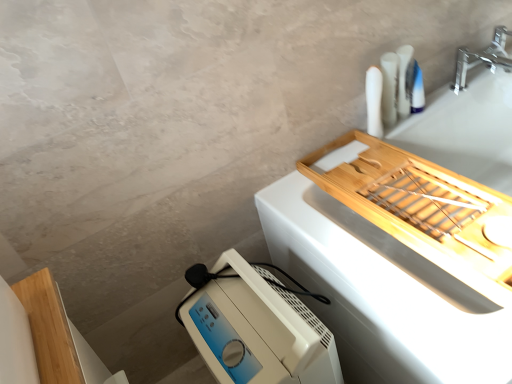
This screenshot has width=512, height=384. Describe the element at coordinates (383, 294) in the screenshot. I see `natural wood tray at upper right` at that location.

Locate an element on the screen. Image resolution: width=512 pixels, height=384 pixels. white plastic humidifier at lower left is located at coordinates (257, 329).

Locate an element on the screen. white matte toothpaste tubes at upper right, which is counted as the 2th toiletry, starting from the left is located at coordinates (405, 80).

Could you tell me if white matte toothpaste tubes at upper right, which is counted as the 2th toiletry, starting from the left, is facing white plastic toothbrush at upper right, which is the 3th toiletry from right to left?

No, white matte toothpaste tubes at upper right, which is counted as the 2th toiletry, starting from the left, is not aimed at white plastic toothbrush at upper right, which is the 3th toiletry from right to left.

Between white matte toothpaste tubes at upper right, which is counted as the 2th toiletry, starting from the left, and white plastic toothbrush at upper right, acting as the first toiletry starting from the left, which one appears on the right side from the viewer's perspective?

Result: white matte toothpaste tubes at upper right, which is counted as the 2th toiletry, starting from the left.

Does white matte toothpaste tubes at upper right, which is counted as the 2th toiletry, starting from the left, have a smaller size compared to white plastic toothbrush at upper right, acting as the first toiletry starting from the left?

Indeed, white matte toothpaste tubes at upper right, which is counted as the 2th toiletry, starting from the left, has a smaller size compared to white plastic toothbrush at upper right, acting as the first toiletry starting from the left.

From a real-world perspective, between white matte toothpaste tubes at upper right, the second toiletry in the right-to-left sequence, and white plastic toothbrush at upper right, acting as the first toiletry starting from the left, who is vertically lower?

white matte toothpaste tubes at upper right, the second toiletry in the right-to-left sequence, is physically lower.

Which object is positioned more to the left, white plastic toothpaste tube at upper right, acting as the 3th toiletry starting from the left, or silver metallic faucet at upper right?

From the viewer's perspective, white plastic toothpaste tube at upper right, acting as the 3th toiletry starting from the left, appears more on the left side.

Does white plastic toothpaste tube at upper right, which ranks as the 1th toiletry in right-to-left order, touch silver metallic faucet at upper right?

No, white plastic toothpaste tube at upper right, which ranks as the 1th toiletry in right-to-left order, is not with silver metallic faucet at upper right.

Which object is further away from the camera, white plastic toothpaste tube at upper right, which ranks as the 1th toiletry in right-to-left order, or silver metallic faucet at upper right?

silver metallic faucet at upper right is further from the camera.

Does natural wood tray at upper right have a lesser width compared to white plastic toothbrush at upper right, acting as the first toiletry starting from the left?

In fact, natural wood tray at upper right might be wider than white plastic toothbrush at upper right, acting as the first toiletry starting from the left.

From the image's perspective, which object appears higher, natural wood tray at upper right or white plastic toothbrush at upper right, which is the 3th toiletry from right to left?

white plastic toothbrush at upper right, which is the 3th toiletry from right to left.

From a real-world perspective, is natural wood tray at upper right beneath white plastic toothbrush at upper right, which is the 3th toiletry from right to left?

Yes, from a real-world perspective, natural wood tray at upper right is below white plastic toothbrush at upper right, which is the 3th toiletry from right to left.

Is natural wood tray at upper right oriented towards white plastic toothbrush at upper right, which is the 3th toiletry from right to left?

No.

Measure the distance from white matte toothpaste tubes at upper right, which is counted as the 2th toiletry, starting from the left, to silver metallic faucet at upper right.

A distance of 11.56 inches exists between white matte toothpaste tubes at upper right, which is counted as the 2th toiletry, starting from the left, and silver metallic faucet at upper right.

Who is shorter, white matte toothpaste tubes at upper right, the second toiletry in the right-to-left sequence, or silver metallic faucet at upper right?

silver metallic faucet at upper right.

From a real-world perspective, who is located lower, white matte toothpaste tubes at upper right, the second toiletry in the right-to-left sequence, or silver metallic faucet at upper right?

silver metallic faucet at upper right is physically lower.

From a real-world perspective, count 2nd toiletrys upward from the silver metallic faucet at upper right and point to it. Please provide its 2D coordinates.

[(405, 80)]

Does white plastic humidifier at lower left have a greater height compared to silver metallic faucet at upper right?

Correct, white plastic humidifier at lower left is much taller as silver metallic faucet at upper right.

How far apart are white plastic humidifier at lower left and silver metallic faucet at upper right?

A distance of 99.49 centimeters exists between white plastic humidifier at lower left and silver metallic faucet at upper right.

What's the angular difference between white plastic humidifier at lower left and silver metallic faucet at upper right's facing directions?

They differ by 91.2 degrees in their facing directions.

Is white plastic humidifier at lower left in contact with silver metallic faucet at upper right?

No, white plastic humidifier at lower left is not with silver metallic faucet at upper right.

Is white matte toothpaste tubes at upper right, which is counted as the 2th toiletry, starting from the left, at the right side of white plastic humidifier at lower left?

Yes, white matte toothpaste tubes at upper right, which is counted as the 2th toiletry, starting from the left, is to the right of white plastic humidifier at lower left.

Would you say white plastic humidifier at lower left is part of white matte toothpaste tubes at upper right, which is counted as the 2th toiletry, starting from the left,'s contents?

No, white plastic humidifier at lower left is not surrounded by white matte toothpaste tubes at upper right, which is counted as the 2th toiletry, starting from the left.

From the image's perspective, which one is positioned lower, white matte toothpaste tubes at upper right, which is counted as the 2th toiletry, starting from the left, or white plastic humidifier at lower left?

From the image's view, white plastic humidifier at lower left is below.

Between white matte toothpaste tubes at upper right, the second toiletry in the right-to-left sequence, and white plastic humidifier at lower left, which one has smaller size?

white matte toothpaste tubes at upper right, the second toiletry in the right-to-left sequence.

From the picture: Is white matte toothpaste tubes at upper right, which is counted as the 2th toiletry, starting from the left, positioned before natural wood tray at upper right?

No, the depth of white matte toothpaste tubes at upper right, which is counted as the 2th toiletry, starting from the left, is greater than that of natural wood tray at upper right.

Looking at this image, is white matte toothpaste tubes at upper right, which is counted as the 2th toiletry, starting from the left, oriented away from natural wood tray at upper right?

No.

Who is smaller, white matte toothpaste tubes at upper right, which is counted as the 2th toiletry, starting from the left, or natural wood tray at upper right?

Smaller between the two is white matte toothpaste tubes at upper right, which is counted as the 2th toiletry, starting from the left.

Considering the sizes of objects white matte toothpaste tubes at upper right, which is counted as the 2th toiletry, starting from the left, and natural wood tray at upper right in the image provided, who is thinner, white matte toothpaste tubes at upper right, which is counted as the 2th toiletry, starting from the left, or natural wood tray at upper right?

white matte toothpaste tubes at upper right, which is counted as the 2th toiletry, starting from the left, is thinner.

Where is `toiletry in front of the white matte toothpaste tubes at upper right, which is counted as the 2th toiletry, starting from the left`? This screenshot has height=384, width=512. toiletry in front of the white matte toothpaste tubes at upper right, which is counted as the 2th toiletry, starting from the left is located at coordinates coord(374,101).

From the image's perspective, which toiletry is the 2nd one below the silver metallic faucet at upper right? Please provide its 2D coordinates.

[(417, 90)]

When comparing their distances from silver metallic faucet at upper right, does natural wood tray at upper right or white plastic toothpaste tube at upper right, acting as the 3th toiletry starting from the left, seem further?

natural wood tray at upper right.

From the image, which object appears to be farther from white plastic toothpaste tube at upper right, which ranks as the 1th toiletry in right-to-left order, white matte toothpaste tubes at upper right, the second toiletry in the right-to-left sequence, or silver metallic faucet at upper right?

silver metallic faucet at upper right lies further to white plastic toothpaste tube at upper right, which ranks as the 1th toiletry in right-to-left order, than the other object.

Considering their positions, is natural wood tray at upper right positioned closer to white plastic humidifier at lower left than white plastic toothbrush at upper right, acting as the first toiletry starting from the left?

natural wood tray at upper right.

Based on their spatial positions, is silver metallic faucet at upper right or white matte toothpaste tubes at upper right, which is counted as the 2th toiletry, starting from the left, further from white plastic toothpaste tube at upper right, acting as the 3th toiletry starting from the left?

silver metallic faucet at upper right is further to white plastic toothpaste tube at upper right, acting as the 3th toiletry starting from the left.

Based on the photo, from the image, which object appears to be nearer to white matte toothpaste tubes at upper right, the second toiletry in the right-to-left sequence, white plastic toothpaste tube at upper right, acting as the 3th toiletry starting from the left, or white plastic toothbrush at upper right, which is the 3th toiletry from right to left?

white plastic toothpaste tube at upper right, acting as the 3th toiletry starting from the left.

From the picture: Which object lies nearer to the anchor point white plastic toothpaste tube at upper right, which ranks as the 1th toiletry in right-to-left order, white plastic toothbrush at upper right, which is the 3th toiletry from right to left, or silver metallic faucet at upper right?

white plastic toothbrush at upper right, which is the 3th toiletry from right to left.

Consider the image. Based on their spatial positions, is natural wood tray at upper right or silver metallic faucet at upper right closer to white plastic toothbrush at upper right, which is the 3th toiletry from right to left?

silver metallic faucet at upper right lies closer to white plastic toothbrush at upper right, which is the 3th toiletry from right to left, than the other object.

Consider the image. When comparing their distances from white matte toothpaste tubes at upper right, which is counted as the 2th toiletry, starting from the left, does white plastic humidifier at lower left or white plastic toothpaste tube at upper right, which ranks as the 1th toiletry in right-to-left order, seem closer?

Among the two, white plastic toothpaste tube at upper right, which ranks as the 1th toiletry in right-to-left order, is located nearer to white matte toothpaste tubes at upper right, which is counted as the 2th toiletry, starting from the left.

Identify the location of toiletry between natural wood tray at upper right and white matte toothpaste tubes at upper right, the second toiletry in the right-to-left sequence, along the z-axis. (374, 101).

Identify the location of toiletry between white matte toothpaste tubes at upper right, the second toiletry in the right-to-left sequence, and silver metallic faucet at upper right, in the horizontal direction. (417, 90).

Find the location of a particular element. The image size is (512, 384). counter top between silver metallic faucet at upper right and white plastic humidifier at lower left vertically is located at coordinates (383, 294).

Locate an element on the screen. The height and width of the screenshot is (384, 512). toiletry between white plastic toothbrush at upper right, acting as the first toiletry starting from the left, and white plastic toothpaste tube at upper right, acting as the 3th toiletry starting from the left, from left to right is located at coordinates (405, 80).